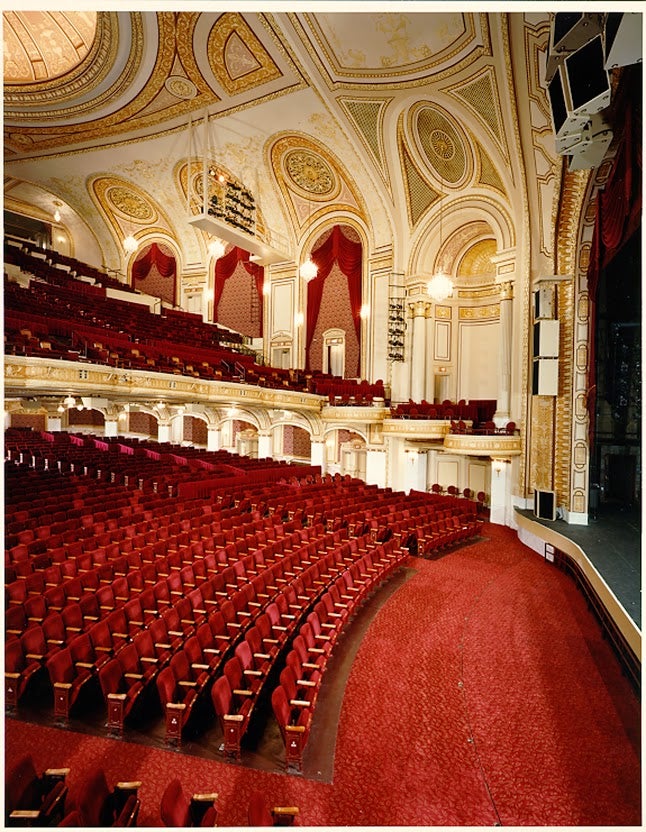
Image resolution: width=646 pixels, height=832 pixels. In order to click on speakers in this screenshot , I will do `click(587, 155)`, `click(620, 62)`, `click(590, 90)`, `click(564, 107)`, `click(563, 145)`, `click(564, 32)`, `click(545, 58)`.